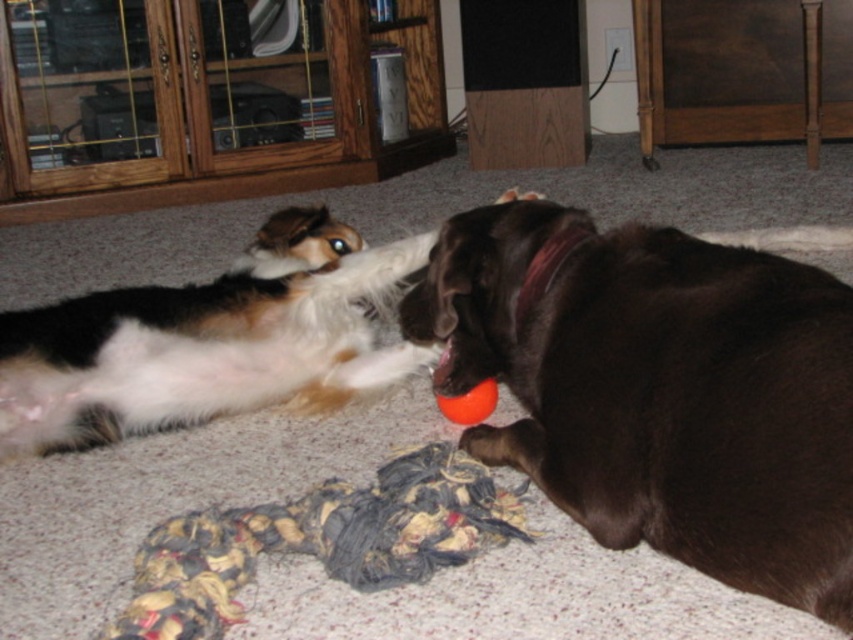
From the picture: You are standing in the living room and want to place a small toy exactly where the white fur dog at upper left is located. What coordinates should you use?

The coordinates for the white fur dog at upper left are at point (207,340), so you should place the toy at those coordinates.

You are standing in the living room and want to take a photo of the white fur dog at upper left. If your camera has a minimum focus distance of 5 feet, will you need to move closer or farther away to capture the dog clearly?

The white fur dog at upper left is currently 4.81 feet away from the camera. Since the minimum focus distance is 5 feet, you need to move slightly farther away to ensure the camera can focus properly.

You are a photographer trying to capture a clear photo of both the shiny brown dog at lower right and the white fur dog at upper left. Which dog should you focus on first to ensure both are in focus?

You should focus on the shiny brown dog at lower right first because it is closer to you than the white fur dog at upper left, so focusing on the closer one first will help ensure both are in focus.